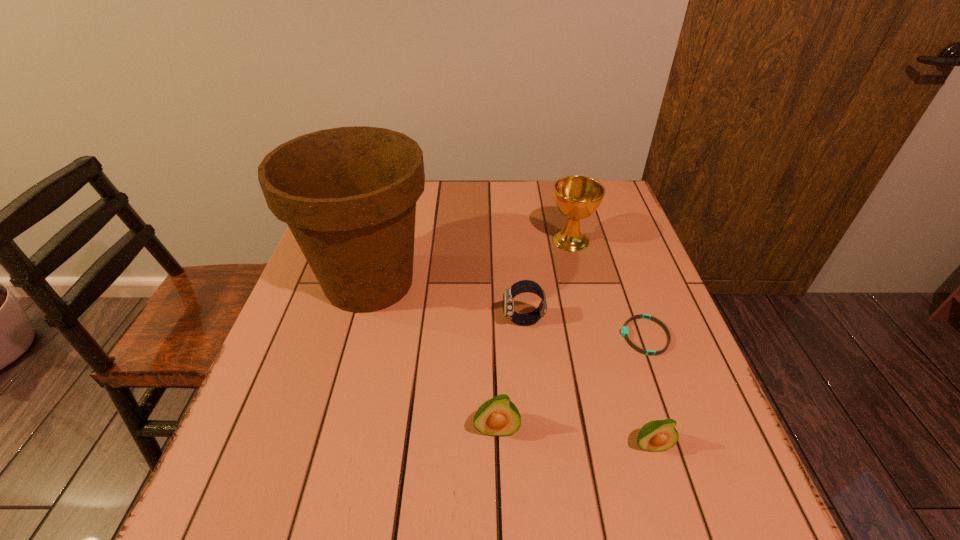
Locate an element on the screen. This screenshot has width=960, height=540. vacant space in between the watch and the shortest object is located at coordinates (584, 329).

Identify the location of free space between the shortest object and the fifth shortest object. (608, 288).

Locate which object is the fourth closest to the left avocado. Please provide its 2D coordinates. Your answer should be formatted as a tuple, i.e. [(x, y)], where the tuple contains the x and y coordinates of a point satisfying the conditions above.

[(624, 331)]

The image size is (960, 540). In order to click on object that is the second nearest to the watch in this screenshot , I will do 348,194.

Locate an element on the screen. free location that satisfies the following two spatial constraints: 1. on the buckle of the wristband; 2. on the cut side of the right avocado is located at coordinates (684, 446).